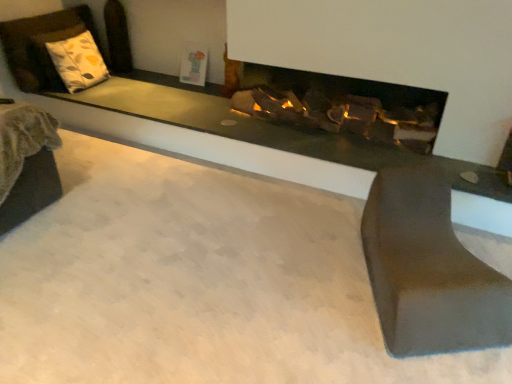
The height and width of the screenshot is (384, 512). Find the location of `white fabric pillow at upper left`. white fabric pillow at upper left is located at coordinates (78, 62).

What do you see at coordinates (78, 62) in the screenshot?
I see `white fabric pillow at upper left` at bounding box center [78, 62].

Image resolution: width=512 pixels, height=384 pixels. Describe the element at coordinates (428, 270) in the screenshot. I see `matte gray bench at lower right` at that location.

Identify the location of matte gray bench at lower right. pyautogui.click(x=428, y=270).

Locate an element on the screen. white fabric pillow at upper left is located at coordinates (78, 62).

Based on their positions, is matte gray bench at lower right located to the left or right of white fabric pillow at upper left?

matte gray bench at lower right is positioned on white fabric pillow at upper left's right side.

Based on the photo, considering the positions of objects matte gray bench at lower right and white fabric pillow at upper left in the image provided, who is behind, matte gray bench at lower right or white fabric pillow at upper left?

white fabric pillow at upper left is more distant.

Considering the positions of point (381, 284) and point (71, 51), is point (381, 284) closer or farther from the camera than point (71, 51)?

Point (381, 284) appears to be closer to the viewer than point (71, 51).

From the image's perspective, between matte gray bench at lower right and white fabric pillow at upper left, who is located below?

matte gray bench at lower right.

From a real-world perspective, is matte gray bench at lower right positioned over white fabric pillow at upper left based on gravity?

No.

Which object is thinner, matte gray bench at lower right or white fabric pillow at upper left?

white fabric pillow at upper left.

Considering the sizes of matte gray bench at lower right and white fabric pillow at upper left in the image, is matte gray bench at lower right taller or shorter than white fabric pillow at upper left?

Clearly, matte gray bench at lower right is shorter compared to white fabric pillow at upper left.

Between matte gray bench at lower right and white fabric pillow at upper left, which one has larger size?

Bigger between the two is matte gray bench at lower right.

Does matte gray bench at lower right contain white fabric pillow at upper left?

No, white fabric pillow at upper left is not surrounded by matte gray bench at lower right.

Are matte gray bench at lower right and white fabric pillow at upper left making contact?

No.

Could you tell me if matte gray bench at lower right is facing white fabric pillow at upper left?

No, matte gray bench at lower right is not facing towards white fabric pillow at upper left.

How different are the orientations of matte gray bench at lower right and white fabric pillow at upper left in degrees?

The angular difference between matte gray bench at lower right and white fabric pillow at upper left is 53.5 degrees.

Measure the distance between matte gray bench at lower right and white fabric pillow at upper left.

matte gray bench at lower right is 2.85 meters away from white fabric pillow at upper left.

Locate an element on the screen. This screenshot has width=512, height=384. pillow that appears above the matte gray bench at lower right (from a real-world perspective) is located at coordinates (78, 62).

Based on the photo, which object is positioned more to the right, white fabric pillow at upper left or matte gray bench at lower right?

matte gray bench at lower right.

Between white fabric pillow at upper left and matte gray bench at lower right, which one is positioned in front?

matte gray bench at lower right is more forward.

Which is in front, point (68, 73) or point (409, 255)?

Point (409, 255)

From the image's perspective, which is above, white fabric pillow at upper left or matte gray bench at lower right?

white fabric pillow at upper left is shown above in the image.

From a real-world perspective, which is physically below, white fabric pillow at upper left or matte gray bench at lower right?

matte gray bench at lower right, from a real-world perspective.

Looking at their sizes, would you say white fabric pillow at upper left is wider or thinner than matte gray bench at lower right?

Clearly, white fabric pillow at upper left has less width compared to matte gray bench at lower right.

Based on the photo, between white fabric pillow at upper left and matte gray bench at lower right, which one has more height?

With more height is white fabric pillow at upper left.

Considering the sizes of objects white fabric pillow at upper left and matte gray bench at lower right in the image provided, who is bigger, white fabric pillow at upper left or matte gray bench at lower right?

matte gray bench at lower right.

Would you say white fabric pillow at upper left is outside matte gray bench at lower right?

white fabric pillow at upper left is positioned outside matte gray bench at lower right.

Is white fabric pillow at upper left directly adjacent to matte gray bench at lower right?

They are not placed beside each other.

Could you tell me if white fabric pillow at upper left is facing matte gray bench at lower right?

Yes.

What's the angular difference between white fabric pillow at upper left and matte gray bench at lower right's facing directions?

53.5 degrees.

You are a GUI agent. You are given a task and a screenshot of the screen. Output one action in this format:
    pyautogui.click(x=<x>, y=<y>)
    Task: Click on the pillow above the matte gray bench at lower right (from the image's perspective)
    The width and height of the screenshot is (512, 384).
    Given the screenshot: What is the action you would take?
    pyautogui.click(x=78, y=62)

In order to click on furniture below the white fabric pillow at upper left (from a real-world perspective) in this screenshot , I will do [x=428, y=270].

There is a matte gray bench at lower right. What are the coordinates of `pillow above it (from a real-world perspective)` in the screenshot? It's located at (78, 62).